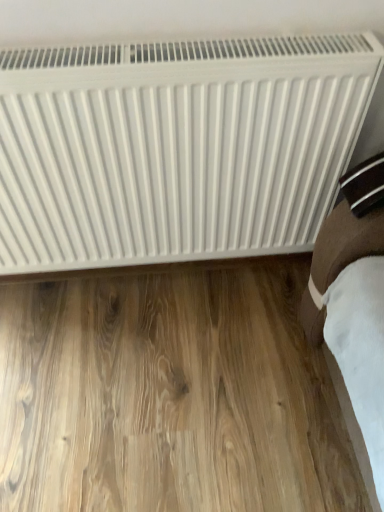
Identify the location of free space above light brown wood flooring at lower center (from a real-world perspective). (154, 381).